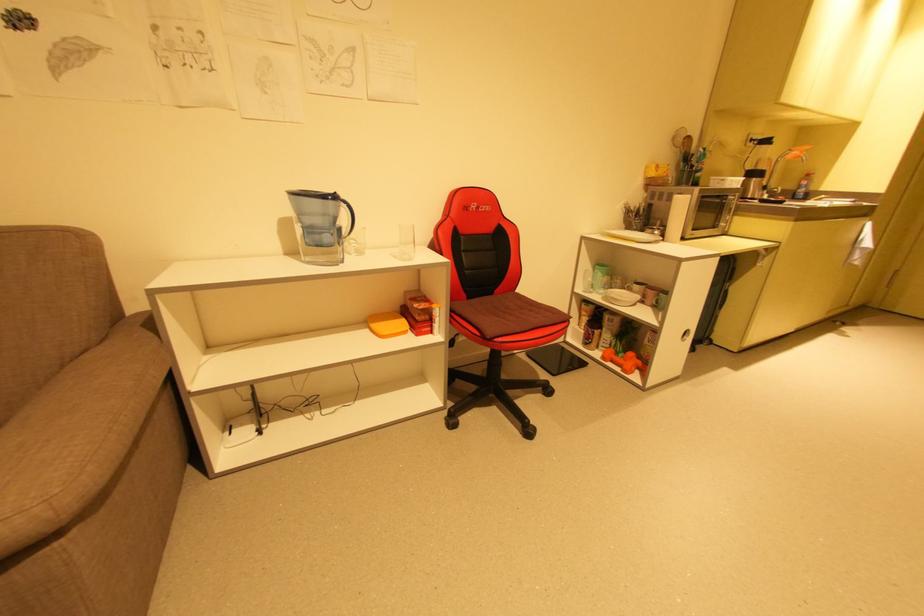
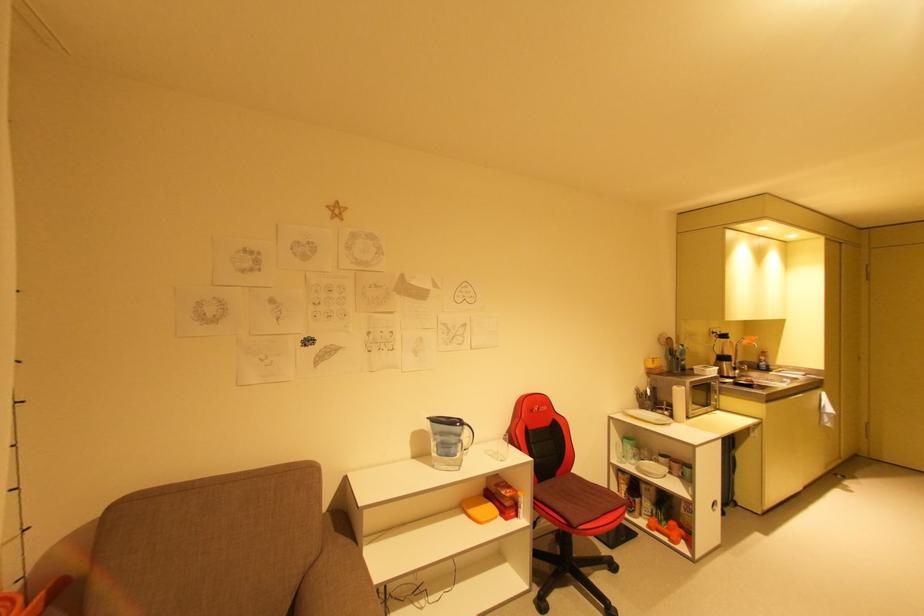
Locate, in the second image, the point that corresponds to (716,331) in the first image.

(737, 493)